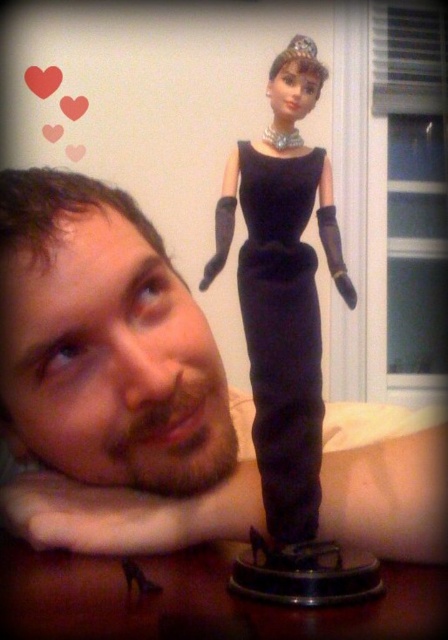
You are an interior designer arranging a display. You have the matte black doll at upper center and the silver metallic tiara at upper center. If you want to place a decorative item between them, where should it go?

Since the matte black doll at upper center is in front of the silver metallic tiara at upper center, you should place the decorative item between them along the depth axis, positioning it either in front of the tiara but behind the doll or behind both items depending on the desired arrangement.

You are an interior designer arranging a display. You have the matte black dress at center and the silver metallic tiara at upper center in your design. According to the spatial arrangement, which object should you place lower to maintain the original perspective?

The matte black dress at center should be placed lower because it is closer to the viewer than the silver metallic tiara at upper center, so positioning it lower in the display will maintain the original perspective where closer objects appear lower.